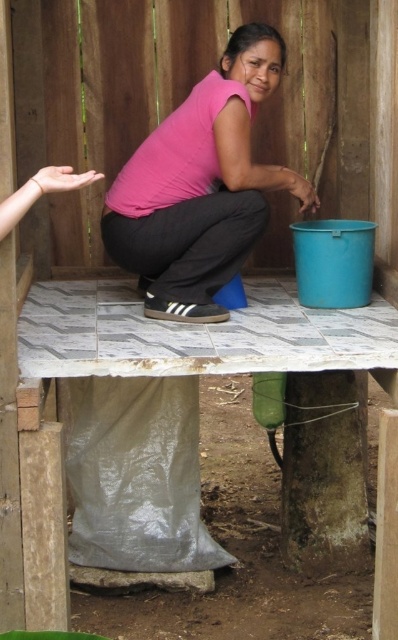
Based on the photo, does white tiled picnic table at center come behind pink matte shirt at center?

That is False.

Can you confirm if white tiled picnic table at center is shorter than pink matte shirt at center?

In fact, white tiled picnic table at center may be taller than pink matte shirt at center.

Between point (60, 609) and point (212, 131), which one is positioned behind?

Point (212, 131)

What are the coordinates of `white tiled picnic table at center` in the screenshot? It's located at (158, 378).